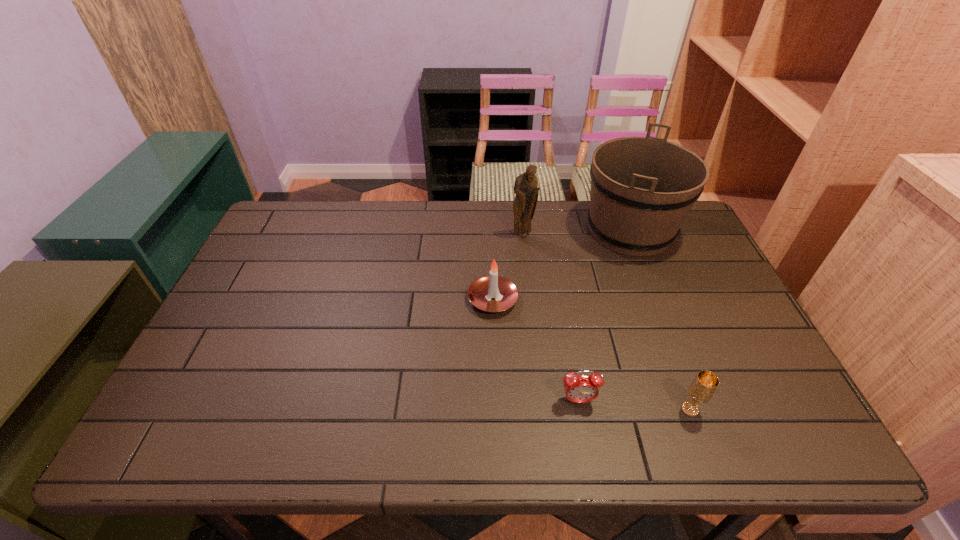
Locate an element on the screen. The height and width of the screenshot is (540, 960). vacant space located on the face of the third object from left to right is located at coordinates (586, 441).

What are the coordinates of `bucket that is at the far edge` in the screenshot? It's located at (642, 188).

What are the coordinates of `figurine that is at the far edge` in the screenshot? It's located at (526, 189).

The image size is (960, 540). What are the coordinates of `object that is at the near edge` in the screenshot? It's located at (701, 390).

Find the location of a particular element. object that is at the right edge is located at coordinates (642, 188).

This screenshot has height=540, width=960. I want to click on object that is at the far right corner, so click(642, 188).

At what (x,y) coordinates should I click in order to perform the action: click on blank space at the far edge of the desktop. Please return your answer as a coordinate pair (x, y). The height and width of the screenshot is (540, 960). Looking at the image, I should click on (404, 222).

This screenshot has height=540, width=960. In order to click on free space at the near edge of the desktop in this screenshot , I will do `click(435, 452)`.

I want to click on vacant space at the left edge of the desktop, so tap(282, 285).

Where is `blank space at the right edge of the desktop`? This screenshot has height=540, width=960. blank space at the right edge of the desktop is located at coordinates (705, 261).